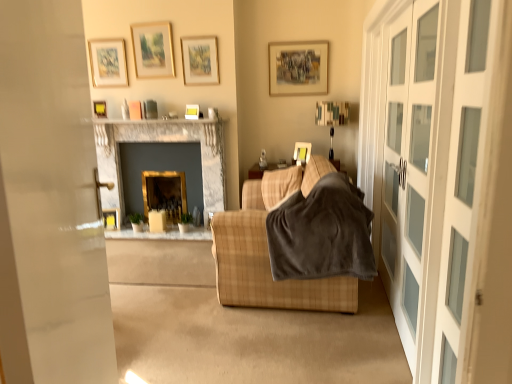
Identify the location of marble fireplace at center, which is the first fireplace in left-to-right order. (162, 141).

Where is `wooden picture frame at lower left, which appears as the second picture frame when viewed from the left`? The height and width of the screenshot is (384, 512). wooden picture frame at lower left, which appears as the second picture frame when viewed from the left is located at coordinates (111, 218).

In order to click on matte gold picture frame at upper center, the 5th picture frame in the right-to-left sequence in this screenshot , I will do `click(153, 50)`.

Locate an element on the screen. This screenshot has width=512, height=384. white frosted glass doors at right is located at coordinates (442, 180).

What's the angular difference between wooden picture frame at lower left, the seventh picture frame from the right, and matte brown picture frame at upper center, the second picture frame in the right-to-left sequence,'s facing directions?

The angular difference between wooden picture frame at lower left, the seventh picture frame from the right, and matte brown picture frame at upper center, the second picture frame in the right-to-left sequence, is 16.1 degrees.

From the image's perspective, is wooden picture frame at lower left, the seventh picture frame from the right, above matte brown picture frame at upper center, which appears as the seventh picture frame when viewed from the left?

Incorrect, from the image's perspective, wooden picture frame at lower left, the seventh picture frame from the right, is lower than matte brown picture frame at upper center, which appears as the seventh picture frame when viewed from the left.

Is wooden picture frame at lower left, the seventh picture frame from the right, aimed at matte brown picture frame at upper center, which appears as the seventh picture frame when viewed from the left?

No, wooden picture frame at lower left, the seventh picture frame from the right, is not aimed at matte brown picture frame at upper center, which appears as the seventh picture frame when viewed from the left.

Is there a large distance between wooden picture frame at lower left, which appears as the second picture frame when viewed from the left, and matte brown picture frame at upper center, which appears as the seventh picture frame when viewed from the left?

Yes, wooden picture frame at lower left, which appears as the second picture frame when viewed from the left, and matte brown picture frame at upper center, which appears as the seventh picture frame when viewed from the left, are located far from each other.

Which point is more distant from viewer, (109, 119) or (203, 187)?

The point (203, 187) is behind.

Is marble fireplace at upper center aimed at marble fireplace at center, arranged as the 2th fireplace when viewed from the right?

No.

How distant is marble fireplace at upper center from marble fireplace at center, which is the first fireplace in left-to-right order?

The distance of marble fireplace at upper center from marble fireplace at center, which is the first fireplace in left-to-right order, is 11.42 inches.

Considering the sizes of marble fireplace at upper center and marble fireplace at center, arranged as the 2th fireplace when viewed from the right, in the image, is marble fireplace at upper center wider or thinner than marble fireplace at center, arranged as the 2th fireplace when viewed from the right,?

marble fireplace at upper center is wider than marble fireplace at center, arranged as the 2th fireplace when viewed from the right.

From the image's perspective, is matte yellow picture frame at upper center, the eighth picture frame positioned from the left, located above white frosted glass doors at right?

Yes.

Considering the positions of objects matte yellow picture frame at upper center, marked as the 1th picture frame in a right-to-left arrangement, and white frosted glass doors at right in the image provided, who is in front, matte yellow picture frame at upper center, marked as the 1th picture frame in a right-to-left arrangement, or white frosted glass doors at right?

white frosted glass doors at right is closer to the camera.

From a real-world perspective, is matte yellow picture frame at upper center, marked as the 1th picture frame in a right-to-left arrangement, below white frosted glass doors at right?

Yes, from a real-world perspective, matte yellow picture frame at upper center, marked as the 1th picture frame in a right-to-left arrangement, is below white frosted glass doors at right.

Is plaid fabric couch at center wider or thinner than matte gold picture frame at upper center, which is the 4th picture frame in left-to-right order?

Clearly, plaid fabric couch at center has more width compared to matte gold picture frame at upper center, which is the 4th picture frame in left-to-right order.

Is point (312, 166) positioned in front of point (151, 36)?

Yes, point (312, 166) is in front of point (151, 36).

Can you confirm if plaid fabric couch at center is shorter than matte gold picture frame at upper center, the 5th picture frame in the right-to-left sequence?

Incorrect, the height of plaid fabric couch at center does not fall short of that of matte gold picture frame at upper center, the 5th picture frame in the right-to-left sequence.

Looking at this image, does plaid fabric couch at center come behind matte gold picture frame at upper center, which is the 4th picture frame in left-to-right order?

No, it is in front of matte gold picture frame at upper center, which is the 4th picture frame in left-to-right order.

Would you say velvety brown blanket at center is outside white glass cabinet at right?

That's correct, velvety brown blanket at center is outside of white glass cabinet at right.

From a real-world perspective, is velvety brown blanket at center positioned above or below white glass cabinet at right?

velvety brown blanket at center is below white glass cabinet at right.

Which is behind, point (327, 233) or point (413, 8)?

The point (327, 233) is behind.

From the image's perspective, who appears lower, white frosted glass doors at right or matte gold picture frame at upper left, which ranks as the 6th picture frame in right-to-left order?

From the image's view, white frosted glass doors at right is below.

Is white frosted glass doors at right far from matte gold picture frame at upper left, the third picture frame from the left?

Yes, white frosted glass doors at right and matte gold picture frame at upper left, the third picture frame from the left, are located far from each other.

How different are the orientations of white frosted glass doors at right and matte gold picture frame at upper left, which ranks as the 6th picture frame in right-to-left order, in degrees?

They differ by 90.1 degrees in their facing directions.

Which of these two, white frosted glass doors at right or matte gold picture frame at upper left, the third picture frame from the left, stands shorter?

matte gold picture frame at upper left, the third picture frame from the left.

Based on the photo, from the image's perspective, is wooden picture frame at lower left, which appears as the second picture frame when viewed from the left, under matte yellow picture frame at upper center, the eighth picture frame positioned from the left?

Indeed, from the image's perspective, wooden picture frame at lower left, which appears as the second picture frame when viewed from the left, is shown beneath matte yellow picture frame at upper center, the eighth picture frame positioned from the left.

Measure the distance from wooden picture frame at lower left, which appears as the second picture frame when viewed from the left, to matte yellow picture frame at upper center, the eighth picture frame positioned from the left.

2.16 meters.

Does wooden picture frame at lower left, the seventh picture frame from the right, have a larger size compared to matte yellow picture frame at upper center, marked as the 1th picture frame in a right-to-left arrangement?

Yes, wooden picture frame at lower left, the seventh picture frame from the right, is bigger than matte yellow picture frame at upper center, marked as the 1th picture frame in a right-to-left arrangement.

Consider the image. Is wooden picture frame at lower left, which appears as the second picture frame when viewed from the left, not close to matte yellow picture frame at upper center, marked as the 1th picture frame in a right-to-left arrangement?

Absolutely, wooden picture frame at lower left, which appears as the second picture frame when viewed from the left, is distant from matte yellow picture frame at upper center, marked as the 1th picture frame in a right-to-left arrangement.

From the image's perspective, which picture frame is the 4th one below the matte brown picture frame at upper center, the second picture frame in the right-to-left sequence? Please provide its 2D coordinates.

[(111, 218)]

What are the coordinates of `mantle in front of the marble fireplace at center, arranged as the 2th fireplace when viewed from the right` in the screenshot? It's located at (158, 122).

Based on their spatial positions, is matte yellow picture frame at upper center, marked as the 1th picture frame in a right-to-left arrangement, or matte gold picture frame at upper left, which ranks as the 6th picture frame in right-to-left order, closer to plaid fabric couch at center?

The object closer to plaid fabric couch at center is matte yellow picture frame at upper center, marked as the 1th picture frame in a right-to-left arrangement.

When comparing their distances from wooden picture frame at lower left, which appears as the second picture frame when viewed from the left, does matte gold picture frame at upper center, positioned as the fifth picture frame in left-to-right order, or velvety brown blanket at center seem further?

velvety brown blanket at center.

From the image, which object appears to be nearer to marble fireplace at upper center, matte yellow picture frame at upper left, the 1th picture frame viewed from the left, or matte gold picture frame at upper left, the third picture frame from the left?

The object closer to marble fireplace at upper center is matte yellow picture frame at upper left, the 1th picture frame viewed from the left.

Which object lies further to the anchor point matte gold picture frame at upper center, the 5th picture frame in the right-to-left sequence, matte gold picture frame at upper center, which is counted as the 4th picture frame, starting from the right, or marble fireplace at center, which is the first fireplace in left-to-right order?

marble fireplace at center, which is the first fireplace in left-to-right order, is further to matte gold picture frame at upper center, the 5th picture frame in the right-to-left sequence.

When comparing their distances from white frosted glass doors at right, does velvety brown blanket at center or marble fireplace at center, arranged as the 2th fireplace when viewed from the right, seem further?

marble fireplace at center, arranged as the 2th fireplace when viewed from the right, is further to white frosted glass doors at right.

Considering their positions, is marble fireplace at center, arranged as the 2th fireplace when viewed from the right, positioned closer to wooden picture frame at lower left, the seventh picture frame from the right, than matte gold picture frame at upper left, which ranks as the 6th picture frame in right-to-left order?

Among the two, marble fireplace at center, arranged as the 2th fireplace when viewed from the right, is located nearer to wooden picture frame at lower left, the seventh picture frame from the right.

Which object lies further to the anchor point marble fireplace at center, arranged as the 2th fireplace when viewed from the right, matte yellow picture frame at upper left, acting as the 8th picture frame starting from the right, or matte gold picture frame at upper center, which is counted as the 4th picture frame, starting from the right?

matte yellow picture frame at upper left, acting as the 8th picture frame starting from the right, lies further to marble fireplace at center, arranged as the 2th fireplace when viewed from the right, than the other object.

When comparing their distances from marble fireplace at upper center, does wooden picture frame at lower left, the seventh picture frame from the right, or matte yellow picture frame at upper center, the eighth picture frame positioned from the left, seem further?

Among the two, matte yellow picture frame at upper center, the eighth picture frame positioned from the left, is located further to marble fireplace at upper center.

Where is `blanket situated between matte yellow picture frame at upper left, acting as the 8th picture frame starting from the right, and matte brown picture frame at upper center, the second picture frame in the right-to-left sequence, from left to right`? blanket situated between matte yellow picture frame at upper left, acting as the 8th picture frame starting from the right, and matte brown picture frame at upper center, the second picture frame in the right-to-left sequence, from left to right is located at coordinates (322, 233).

Locate an element on the screen. The height and width of the screenshot is (384, 512). mantle between matte yellow picture frame at upper left, acting as the 8th picture frame starting from the right, and velvety brown blanket at center from left to right is located at coordinates (158, 122).

Locate an element on the screen. The height and width of the screenshot is (384, 512). studio couch positioned between white glass cabinet at right and marble fireplace at center, which is the first fireplace in left-to-right order, from near to far is located at coordinates (267, 270).

The width and height of the screenshot is (512, 384). I want to click on studio couch between velvety brown blanket at center and matte gold picture frame at upper center, positioned as the fifth picture frame in left-to-right order, along the z-axis, so click(267, 270).